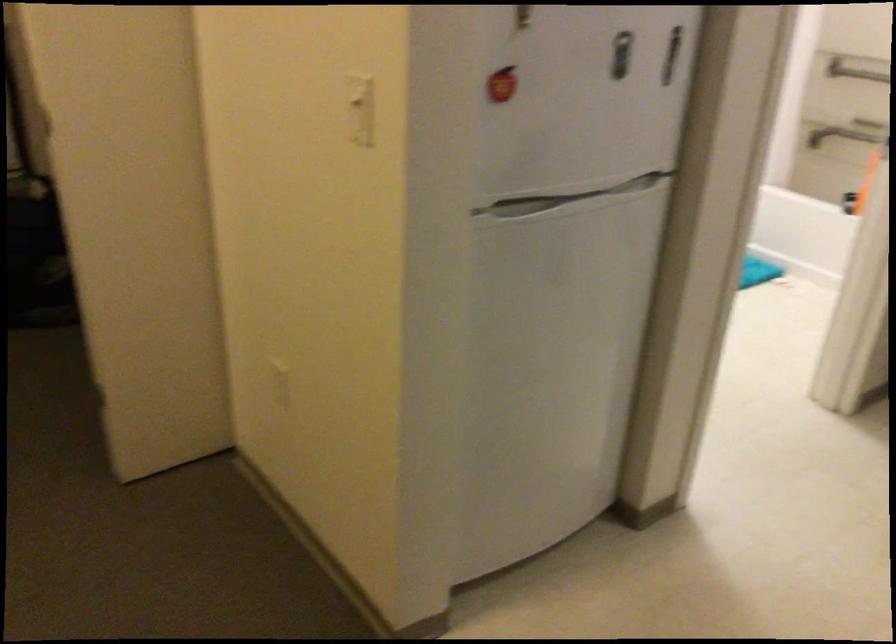
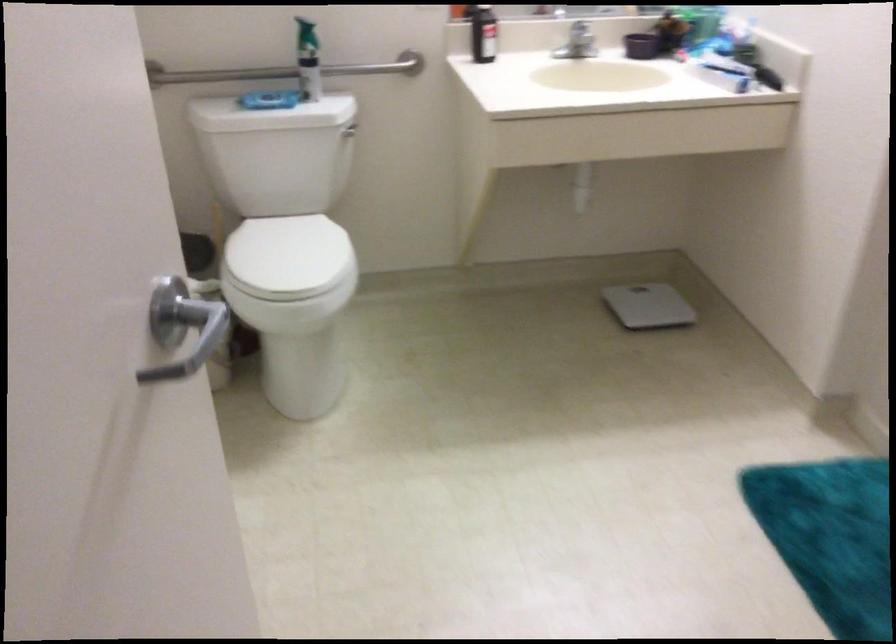
In a continuous first-person perspective shot, in which direction is the camera moving?

The movement direction of the cameraman is right, forward.